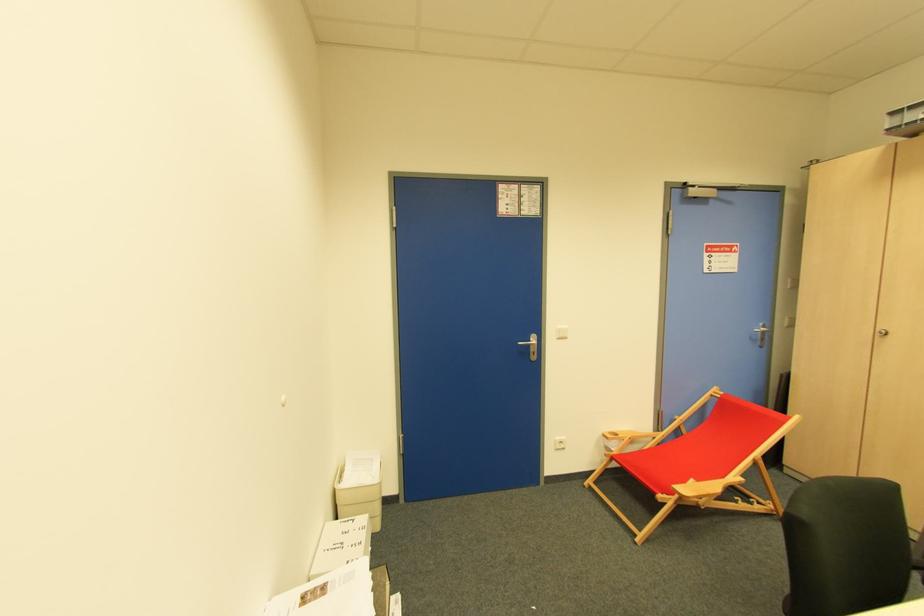
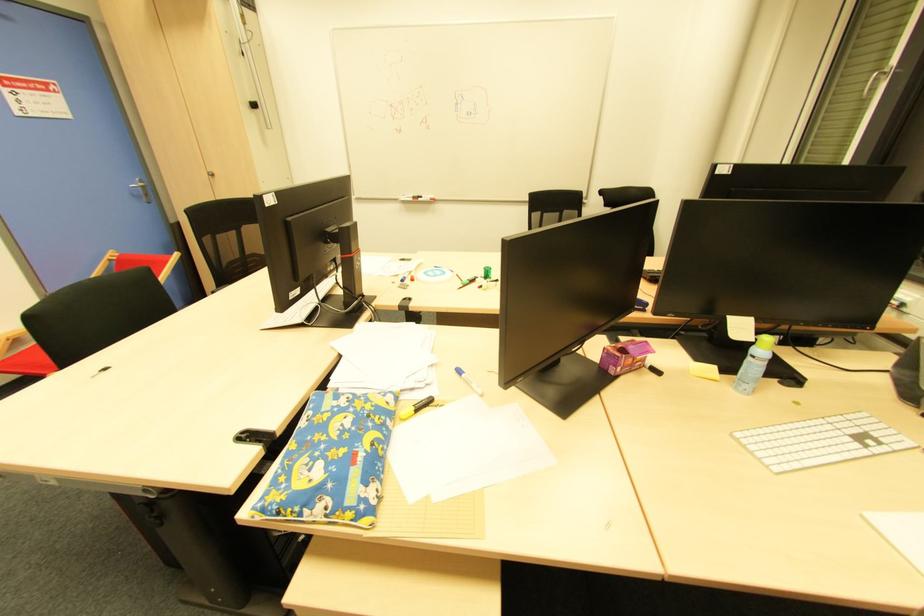
Based on the continuous images, in which direction is the camera rotating?

The camera's rotation is toward right-down.